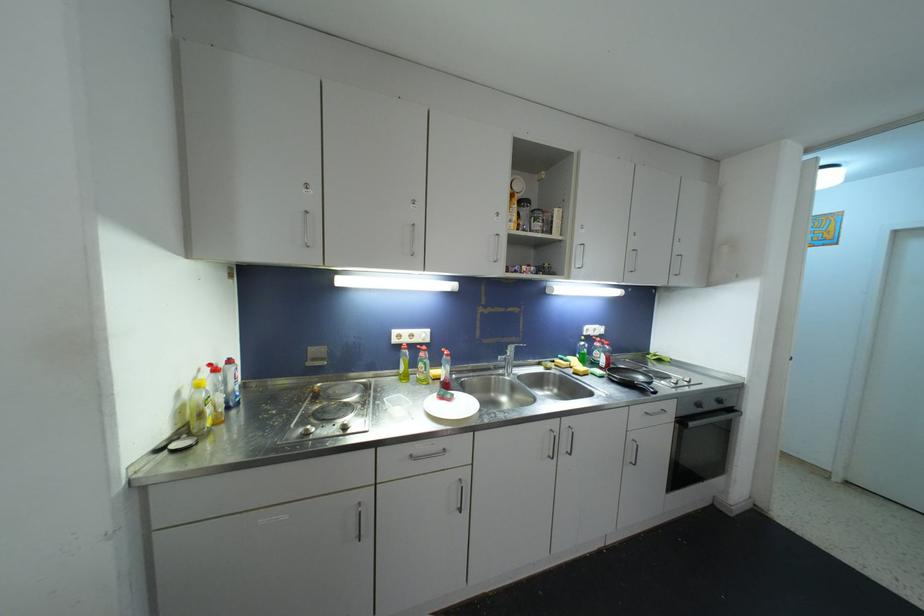
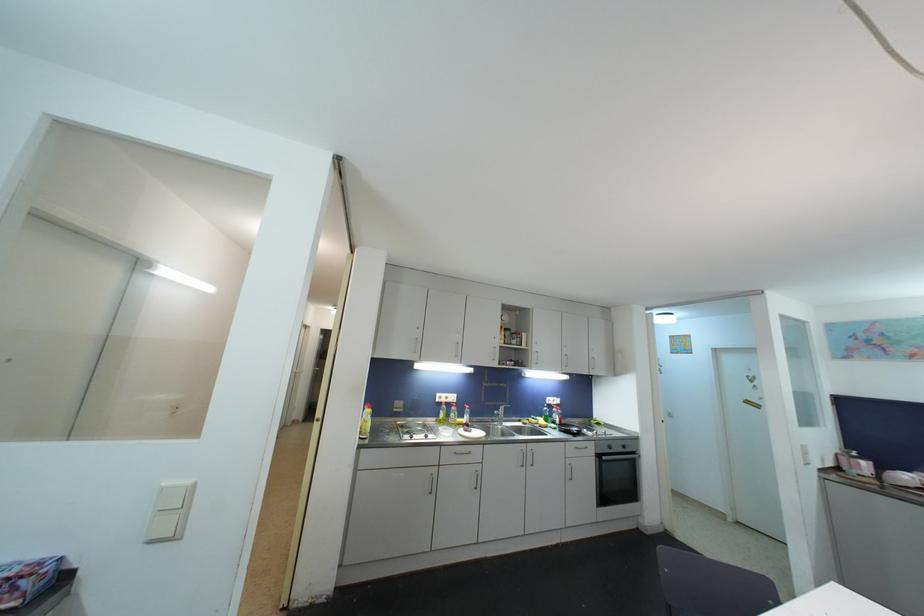
Find the pixel in the second image that matches [397,342] in the first image.

(441, 403)